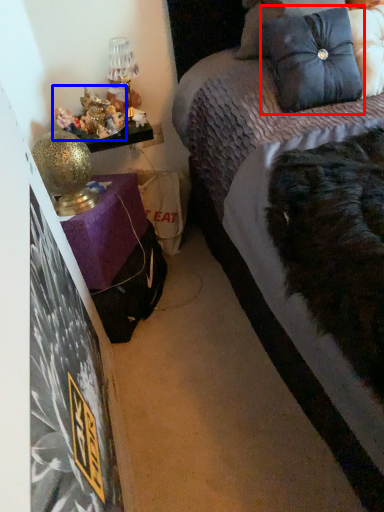
Question: Which object appears farthest to the camera in this image, pillow (highlighted by a red box) or stuff (highlighted by a blue box)?

Choices:
 (A) pillow
 (B) stuff

Answer: (B)